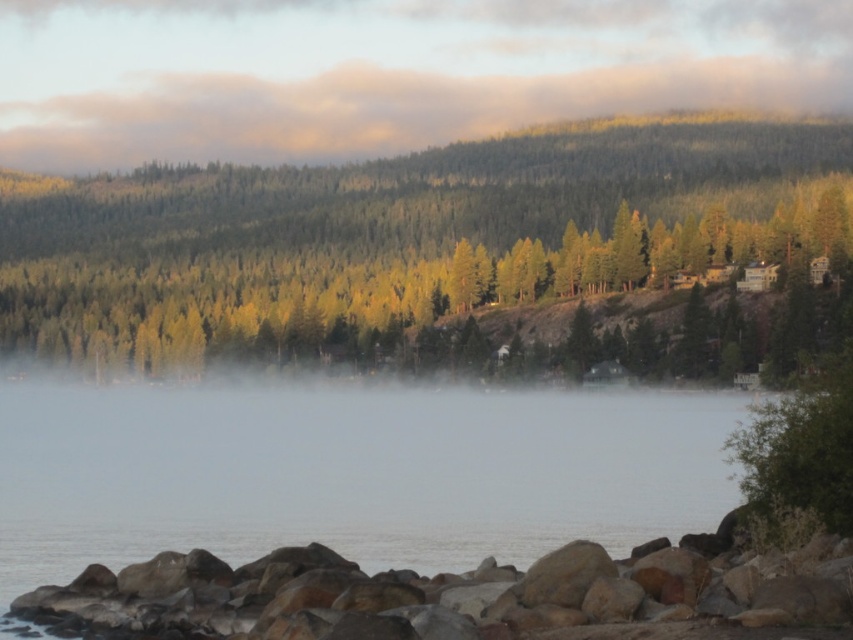
Who is more distant from viewer, [82,304] or [769,563]?

Positioned behind is point [82,304].

Identify the location of green textured trees at center. This screenshot has width=853, height=640. (390, 230).

Where is `green textured trees at center`? Image resolution: width=853 pixels, height=640 pixels. green textured trees at center is located at coordinates (390, 230).

In the scene shown: Does foggy mist at upper center have a lesser height compared to rustic stone rocks at lower left?

In fact, foggy mist at upper center may be taller than rustic stone rocks at lower left.

Does foggy mist at upper center lie behind rustic stone rocks at lower left?

Yes, foggy mist at upper center is further from the viewer.

Between point (404, 150) and point (192, 593), which one is positioned behind?

Positioned behind is point (404, 150).

Where is `foggy mist at upper center`? The image size is (853, 640). foggy mist at upper center is located at coordinates (387, 72).

Is green textured trees at center closer to camera compared to foggy mist at upper center?

Yes, green textured trees at center is closer to the viewer.

Between point (201, 211) and point (607, 96), which one is positioned in front?

Point (201, 211)

Is point (440, 186) in front of point (67, 1)?

Yes, point (440, 186) is closer to viewer.

Locate an element on the screen. The image size is (853, 640). green textured trees at center is located at coordinates (390, 230).